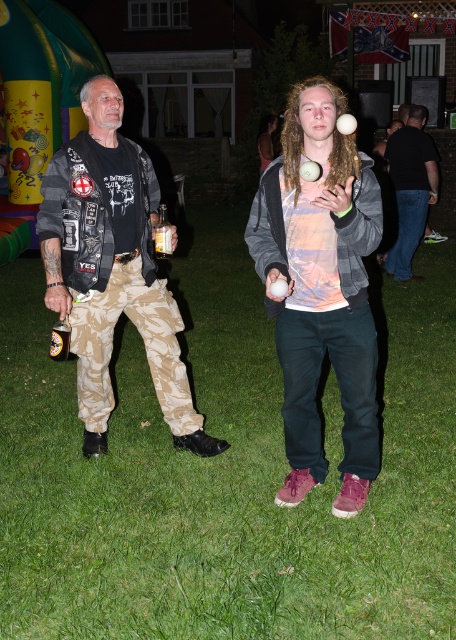
Question: Estimate the real-world distances between objects in this image. Which object is closer to the matte gray hoodie at center?

Choices:
 (A) green grass at center
 (B) camouflage pants at left

Answer: (B)

Question: Does green grass at center appear under matte gray hoodie at center?

Choices:
 (A) no
 (B) yes

Answer: (B)

Question: Estimate the real-world distances between objects in this image. Which object is farther from the green grass at center?

Choices:
 (A) matte gray hoodie at center
 (B) black cotton shirt at right
 (C) metallic gold can at lower left
 (D) camouflage pants at left

Answer: (B)

Question: Can you confirm if camouflage pants at left is positioned below metallic gold can at lower left?

Choices:
 (A) yes
 (B) no

Answer: (B)

Question: Can you confirm if camouflage pants at left is positioned above metallic gold can at lower left?

Choices:
 (A) yes
 (B) no

Answer: (A)

Question: Which object is farther from the camera taking this photo?

Choices:
 (A) metallic gold can at lower left
 (B) green grass at center

Answer: (B)